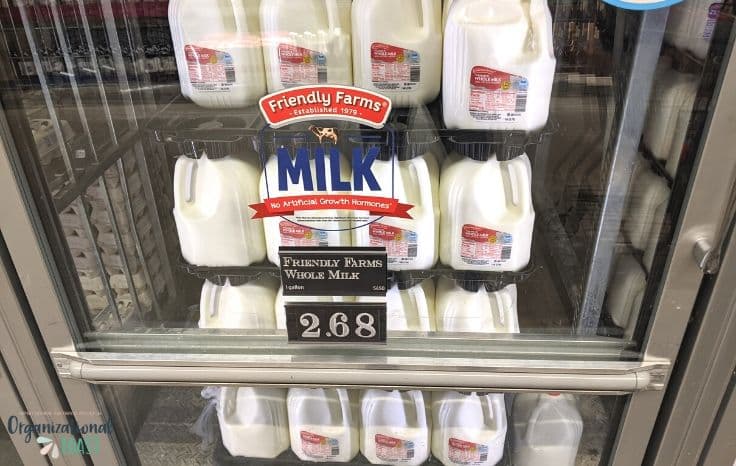
Where is `lower shelf milk`? The image size is (736, 466). lower shelf milk is located at coordinates pos(526,437), pos(435,434), pos(381,428), pos(322,417), pos(241,410).